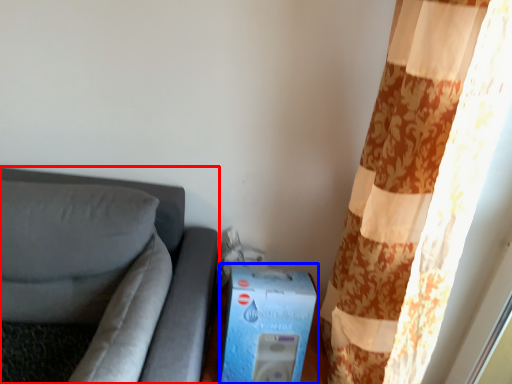
Question: Which object is further to the camera taking this photo, furniture (highlighted by a red box) or box (highlighted by a blue box)?

Choices:
 (A) furniture
 (B) box

Answer: (B)